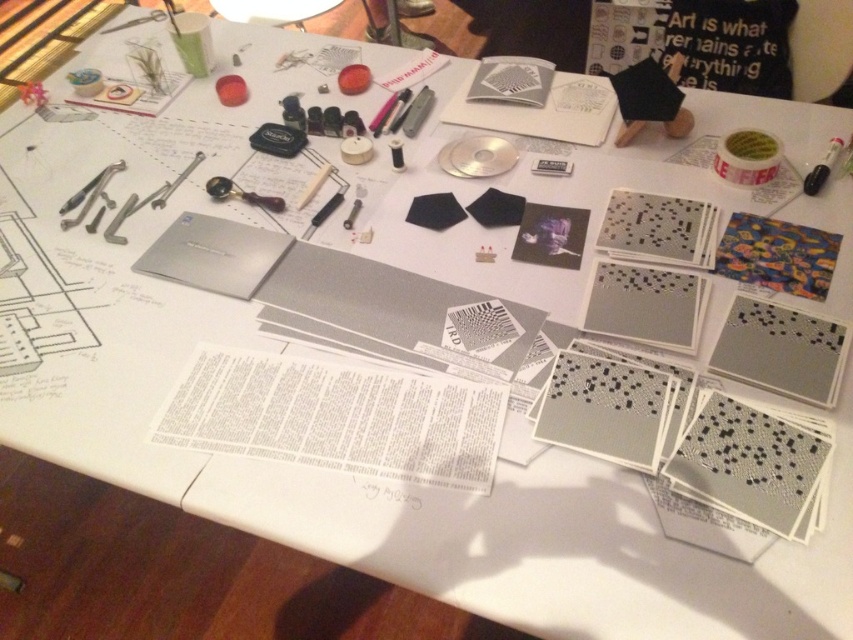
Measure the distance from metallic silver wrench at left to metallic silver pen at center.

metallic silver wrench at left and metallic silver pen at center are 51.74 centimeters apart.

Which is in front, point (85, 204) or point (404, 168)?

Positioned in front is point (85, 204).

This screenshot has width=853, height=640. What are the coordinates of `metallic silver wrench at left` in the screenshot? It's located at [90, 195].

Locate an element on the screen. The image size is (853, 640). metallic silver wrench at left is located at coordinates (90, 195).

Between point (277, 204) and point (428, 90), which one is positioned behind?

The point (428, 90) is more distant.

How distant is metallic keychain at center from metallic gray pen at center?

They are 13.12 inches apart.

This screenshot has width=853, height=640. What do you see at coordinates (241, 195) in the screenshot?
I see `metallic keychain at center` at bounding box center [241, 195].

The width and height of the screenshot is (853, 640). I want to click on metallic keychain at center, so click(241, 195).

Looking at this image, is metallic keychain at center shorter than black marker at upper right?

Indeed, metallic keychain at center has a lesser height compared to black marker at upper right.

Which of these two, metallic keychain at center or black marker at upper right, stands taller?

With more height is black marker at upper right.

Between point (256, 198) and point (807, 173), which one is positioned behind?

The point (256, 198) is more distant.

Identify the location of metallic keychain at center. (241, 195).